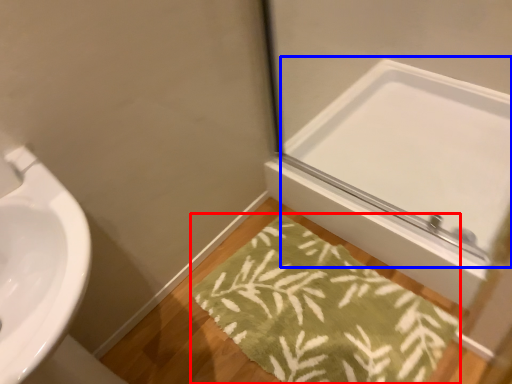
Question: Which point is further to the camera, bath mat (highlighted by a red box) or mirror (highlighted by a blue box)?

Choices:
 (A) bath mat
 (B) mirror

Answer: (B)